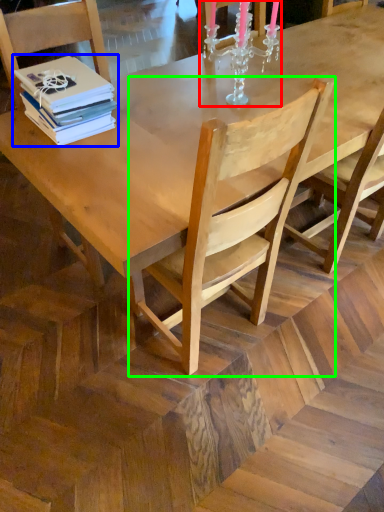
Question: Which object is the farthest from candle holder (highlighted by a red box)? Choose among these: book (highlighted by a blue box) or chair (highlighted by a green box).

Choices:
 (A) book
 (B) chair

Answer: (B)